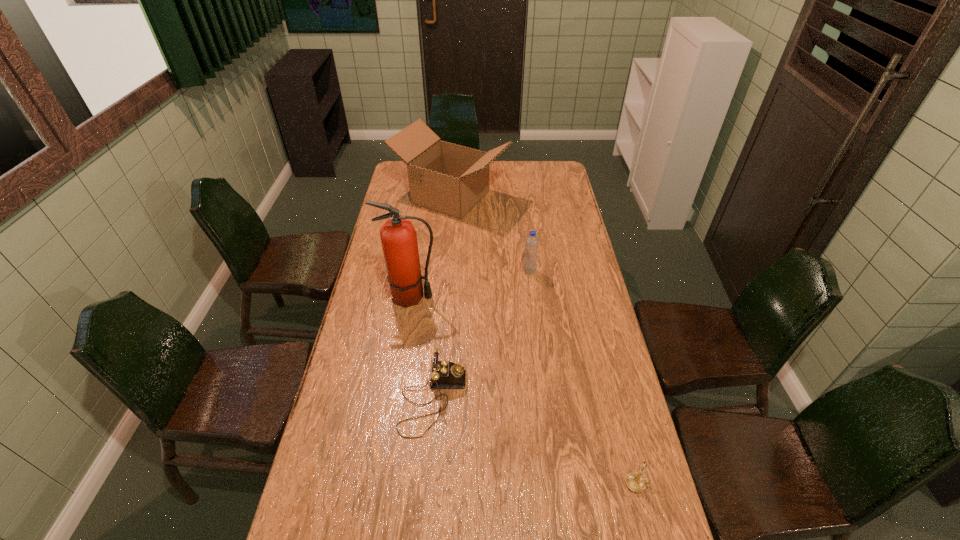
Where is `vacant point located 0.310m on the front of the farthest object`? vacant point located 0.310m on the front of the farthest object is located at coordinates (444, 275).

Find the location of a particular element. This screenshot has width=960, height=540. free space located on the left of the fourth nearest object is located at coordinates pyautogui.click(x=502, y=271).

You are a GUI agent. You are given a task and a screenshot of the screen. Output one action in this format:
    pyautogui.click(x=<x>, y=<y>)
    Task: Click on the vacant area situated 0.140m on the dial of the second nearest object
    
    Given the screenshot: What is the action you would take?
    pyautogui.click(x=513, y=400)

Locate an element on the screen. This screenshot has height=540, width=960. object that is at the far edge is located at coordinates (451, 179).

This screenshot has width=960, height=540. I want to click on fire extinguisher located at the left edge, so click(x=398, y=236).

This screenshot has width=960, height=540. What are the coordinates of `box located in the left edge section of the desktop` in the screenshot? It's located at (451, 179).

At what (x,y) coordinates should I click in order to perform the action: click on object situated at the right edge. Please return your answer as a coordinate pair (x, y). Looking at the image, I should click on (635, 482).

At what (x,y) coordinates should I click in order to perform the action: click on object positioned at the far left corner. Please return your answer as a coordinate pair (x, y). Image resolution: width=960 pixels, height=540 pixels. Looking at the image, I should click on (451, 179).

I want to click on free point at the left edge, so click(x=388, y=330).

Where is `vacant space at the right edge of the desktop`? The height and width of the screenshot is (540, 960). vacant space at the right edge of the desktop is located at coordinates (578, 224).